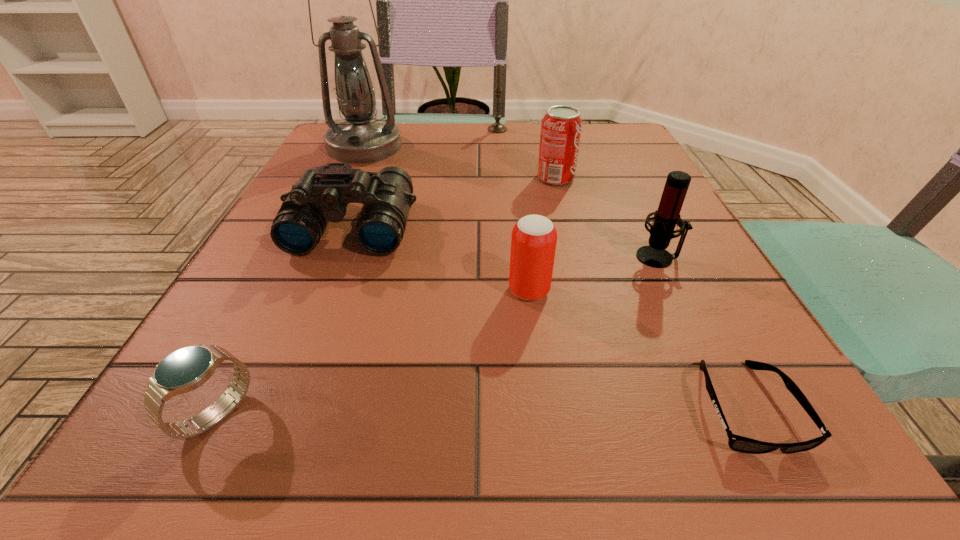
Identify the location of the tallest object. This screenshot has height=540, width=960. (360, 139).

You are a GUI agent. You are given a task and a screenshot of the screen. Output one action in this format:
    pyautogui.click(x=<x>, y=<y>)
    Task: Click on the candle
    This screenshot has width=960, height=540.
    Given the screenshot: What is the action you would take?
    pyautogui.click(x=497, y=127)

This screenshot has width=960, height=540. Find the location of `microphone`. microphone is located at coordinates (654, 255).

Where is `soda can`? The width and height of the screenshot is (960, 540). soda can is located at coordinates (561, 127).

This screenshot has height=540, width=960. Find the location of `the third object from right to left`. the third object from right to left is located at coordinates (561, 127).

Identify the location of binoculars. The height and width of the screenshot is (540, 960). (322, 193).

This screenshot has height=540, width=960. I want to click on the sixth farthest object, so click(534, 237).

At what (x,y) coordinates should I click in order to perform the action: click on watch. Please return your answer as a coordinate pair (x, y). Looking at the image, I should click on (184, 370).

Where is `sunglasses`? The width and height of the screenshot is (960, 540). sunglasses is located at coordinates (737, 443).

Identify the location of vacant space located on the front of the tallest object. coord(348,181).